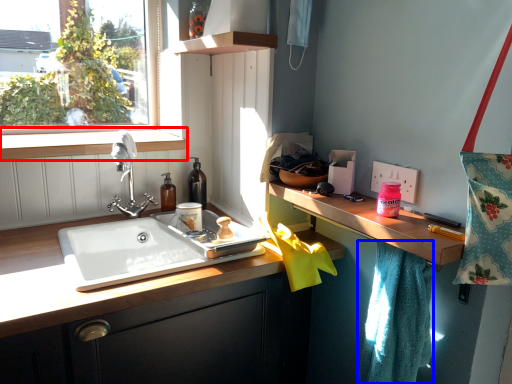
Question: Which of the following is the closest to the observer, window sill (highlighted by a red box) or bath towel (highlighted by a blue box)?

Choices:
 (A) window sill
 (B) bath towel

Answer: (B)